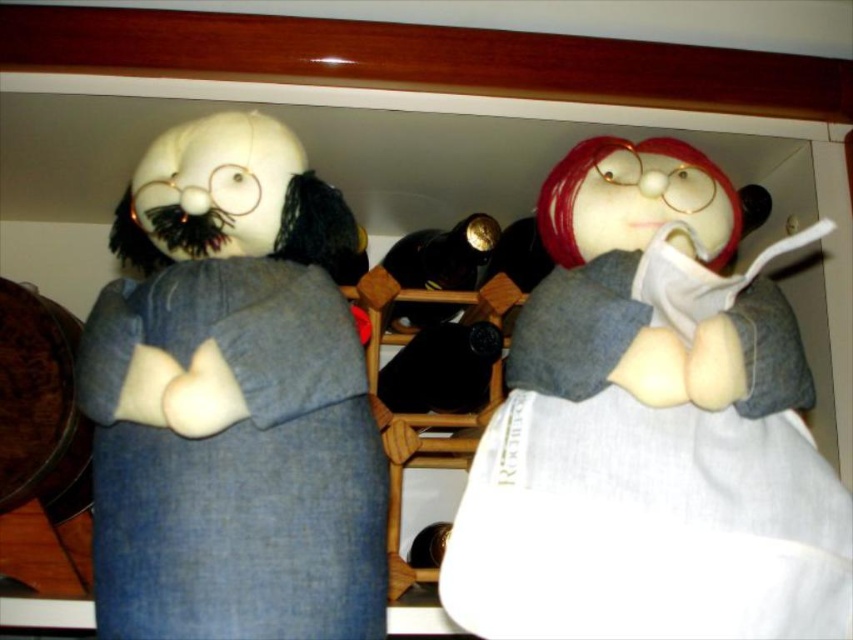
From the picture: You are a toy collector trying to place a new small figurine between the white fabric doll at upper right and the denim jacket at left on a wooden shelf. Based on their positions, which side of the figurine should be closer to the front of the shelf?

The white fabric doll at upper right is further to the viewer than the denim jacket at left, so the figurine should be placed closer to the front near the white fabric doll at upper right.

You are a photographer trying to capture a closeup of the white fabric doll at upper right. The camera you are using has a minimum focusing distance of 16 inches. Will you be able to take the photo without moving the camera closer?

The white fabric doll at upper right is 18.04 inches away from the camera, which is beyond the minimum focusing distance of 16 inches. Therefore, you can take the photo without moving the camera closer.